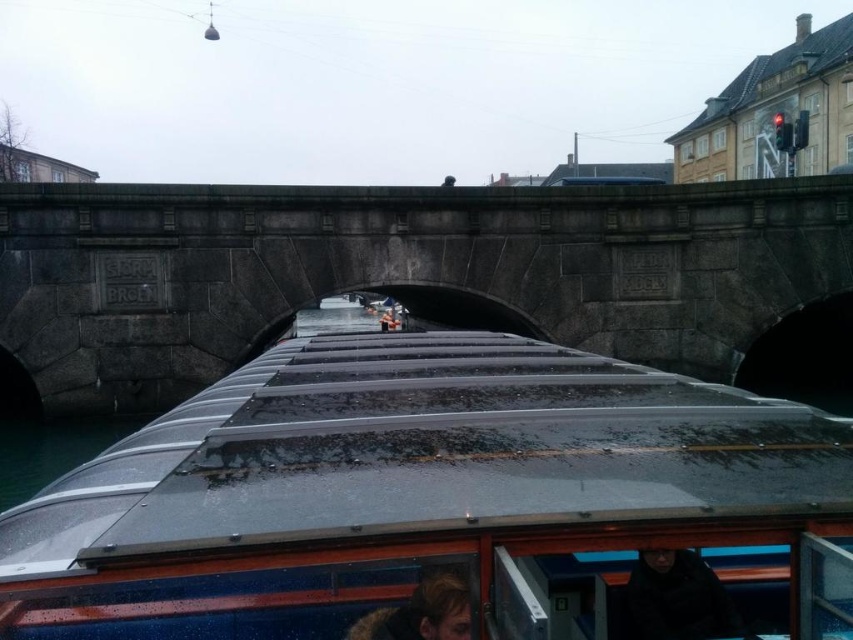
Question: Which object is positioned closest to the black matte jacket at lower center?

Choices:
 (A) transparent plastic boat at center
 (B) dark brown hair at lower center
 (C) clear glass water at lower left
 (D) gray stone bridge at center

Answer: (B)

Question: Among these objects, which one is farthest from the camera?

Choices:
 (A) transparent plastic boat at center
 (B) clear glass water at lower left
 (C) dark brown hair at lower center
 (D) gray stone bridge at center

Answer: (D)

Question: Estimate the real-world distances between objects in this image. Which object is farther from the gray stone bridge at center?

Choices:
 (A) dark brown hair at lower center
 (B) transparent plastic boat at center
 (C) black matte jacket at lower center
 (D) clear glass water at lower left

Answer: (A)

Question: Does gray stone bridge at center come in front of black matte jacket at lower center?

Choices:
 (A) yes
 (B) no

Answer: (B)

Question: Is black matte jacket at lower center to the left of clear glass water at lower left from the viewer's perspective?

Choices:
 (A) no
 (B) yes

Answer: (A)

Question: In this image, where is black matte jacket at lower center located relative to clear glass water at lower left?

Choices:
 (A) below
 (B) above

Answer: (B)